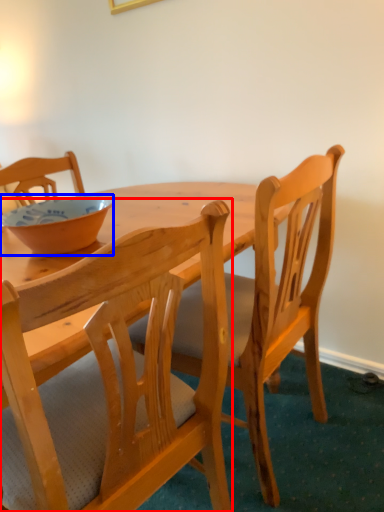
Question: Among these objects, which one is farthest to the camera, chair (highlighted by a red box) or bowl (highlighted by a blue box)?

Choices:
 (A) chair
 (B) bowl

Answer: (B)